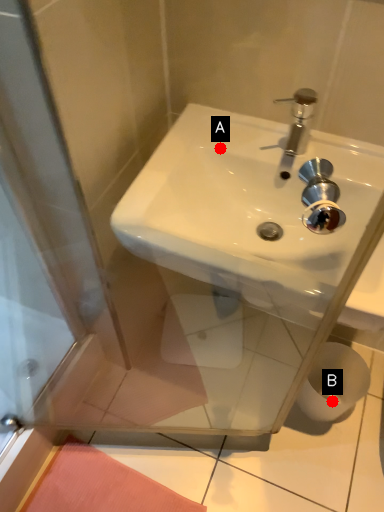
Question: Two points are circled on the image, labeled by A and B beside each circle. Among these points, which one is farthest from the camera?

Choices:
 (A) A is further
 (B) B is further

Answer: (B)